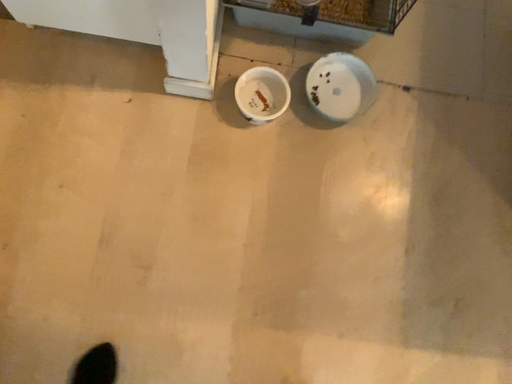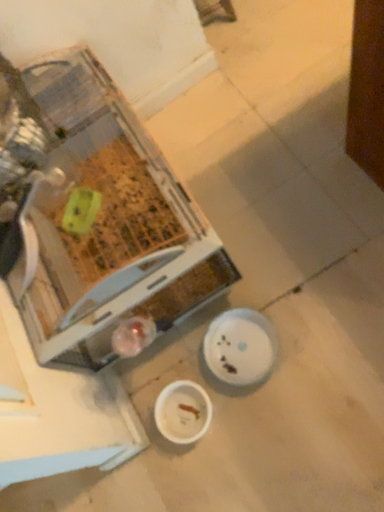
Question: Which way did the camera rotate in the video?

Choices:
 (A) rotated downward
 (B) rotated upward

Answer: (B)